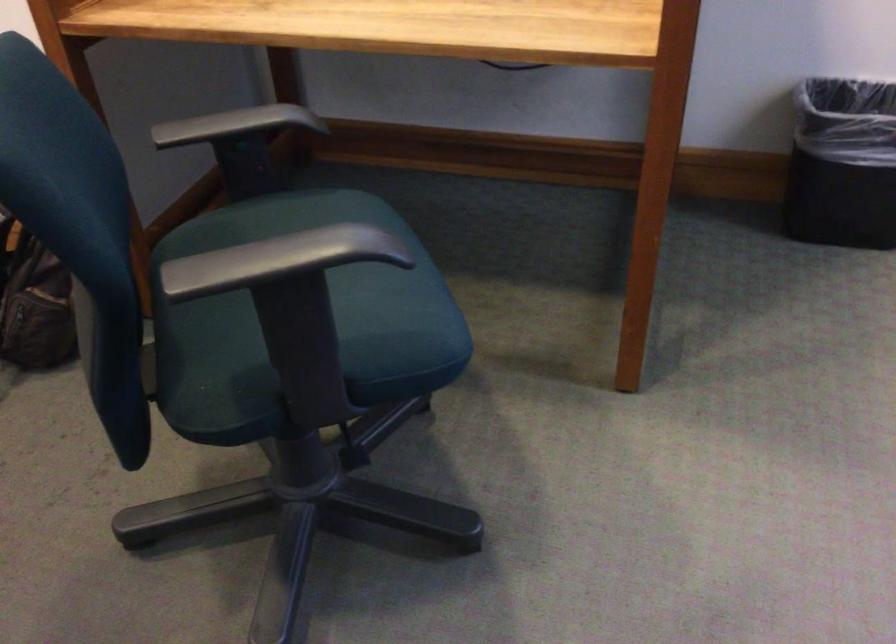
Identify the location of green chair sitting surface. (281, 287).